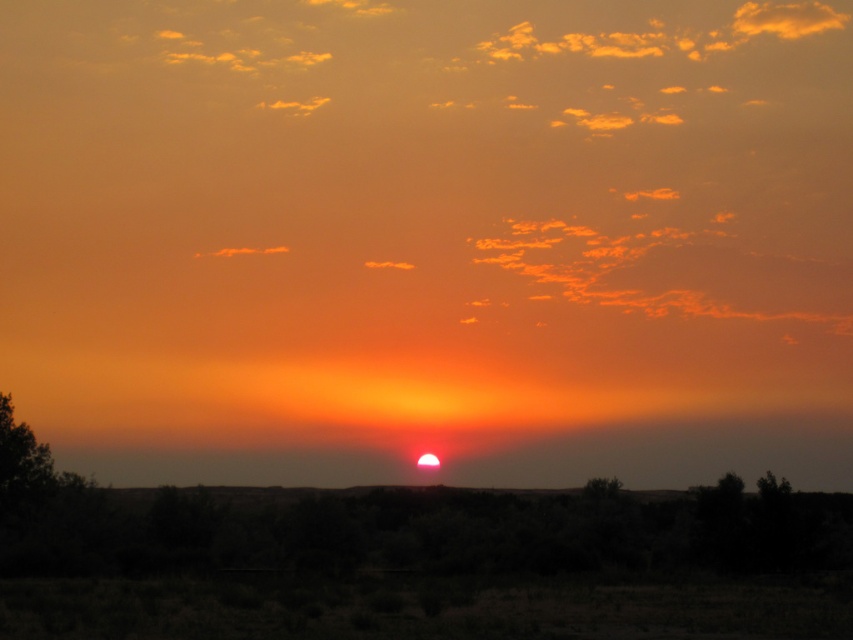
You are an artist trying to paint the sunset scene. You notice two green trees at the center of the image. Which tree is shorter between the green leafy tree at center and the green matte tree at center?

The green leafy tree at center is not as tall as the green matte tree at center, so the green leafy tree at center is shorter.